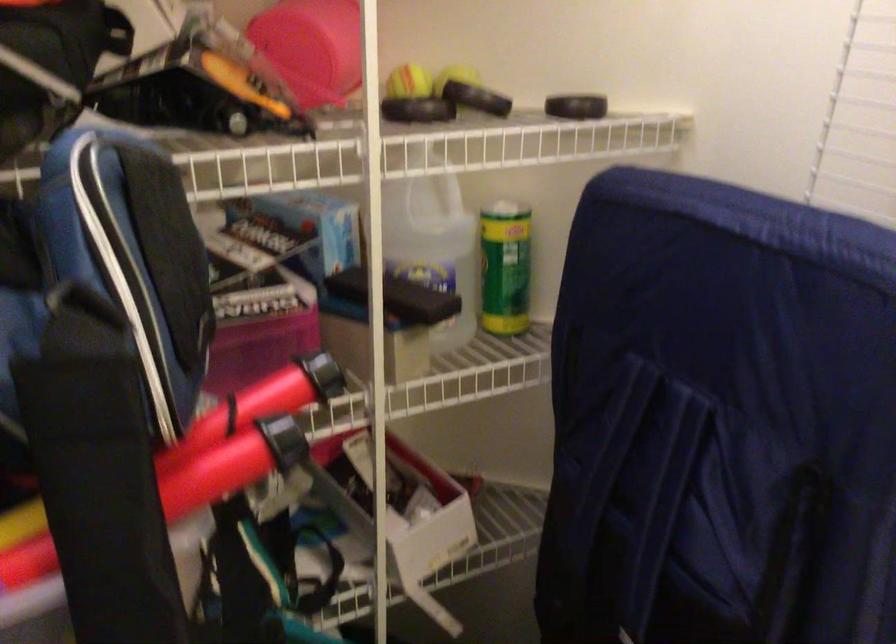
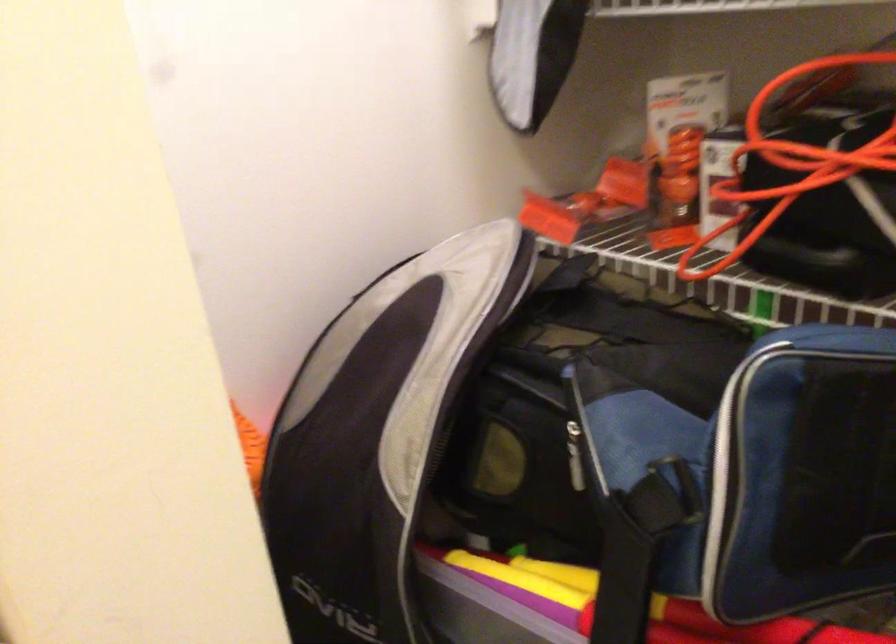
Find the pixel in the second image that matches point (108, 431) in the first image.

(622, 581)